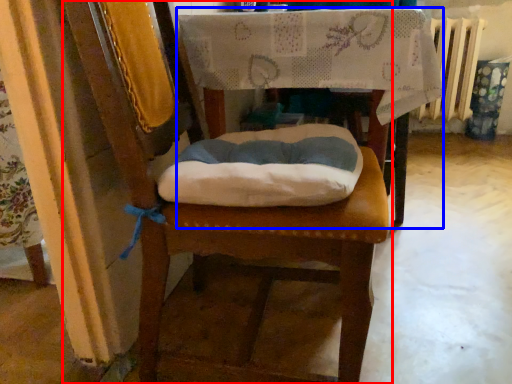
Question: Which object is further to the camera taking this photo, chair (highlighted by a red box) or table (highlighted by a blue box)?

Choices:
 (A) chair
 (B) table

Answer: (B)